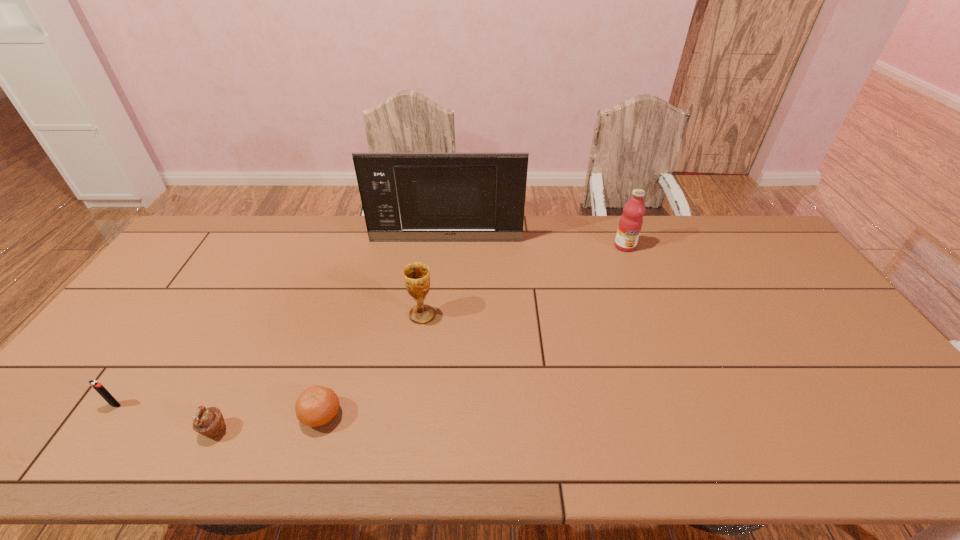
Find the location of a particular element. The width and height of the screenshot is (960, 540). vacant region located 0.270m on the back of the third farthest object is located at coordinates (430, 249).

At what (x,y) coordinates should I click in order to perform the action: click on vacant space located 0.110m on the back of the igniter. Please return your answer as a coordinate pair (x, y). This screenshot has height=540, width=960. Looking at the image, I should click on (143, 365).

Where is `vacant space located on the back of the second object from left to right`? vacant space located on the back of the second object from left to right is located at coordinates (235, 389).

Locate an element on the screen. This screenshot has height=540, width=960. free space located on the back of the clementine is located at coordinates (350, 317).

Locate an element on the screen. microwave oven present at the far edge is located at coordinates (405, 196).

Where is `fruit juice that is positioned at the far edge`? Image resolution: width=960 pixels, height=540 pixels. fruit juice that is positioned at the far edge is located at coordinates [x=631, y=221].

Where is `muffin that is positioned at the near edge`? This screenshot has width=960, height=540. muffin that is positioned at the near edge is located at coordinates (209, 422).

Image resolution: width=960 pixels, height=540 pixels. What are the coordinates of `clementine situated at the near edge` in the screenshot? It's located at (316, 406).

In order to click on object that is at the left edge in this screenshot , I will do `click(95, 384)`.

Find the location of a particular element. Image resolution: width=960 pixels, height=540 pixels. vacant area at the far edge of the desktop is located at coordinates (705, 251).